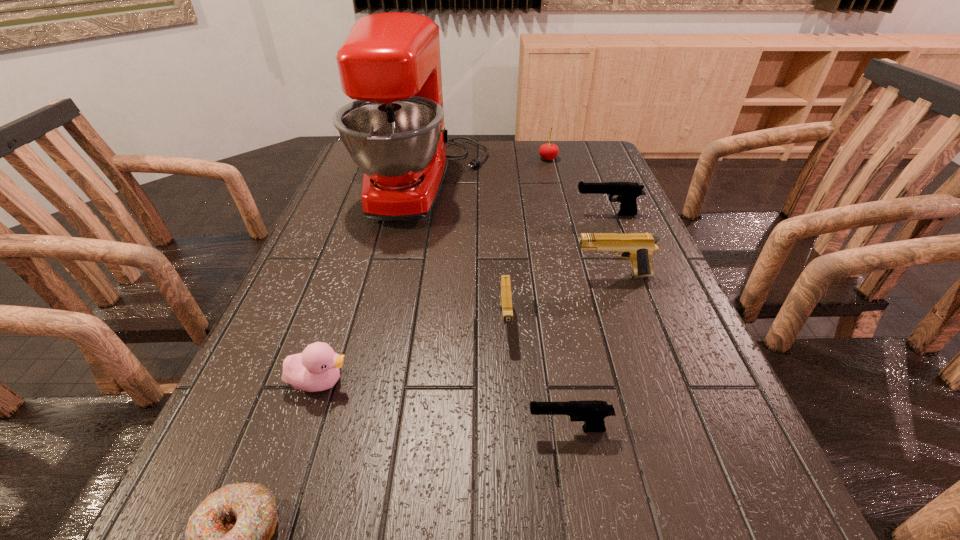
Identify the location of vacant space in between the nearer tan pistol and the red kitchen mixer. The image size is (960, 540). (466, 252).

Locate an element on the screen. This screenshot has height=540, width=960. vacant region between the nearest pistol and the fourth object from left to right is located at coordinates (537, 375).

Find the location of a particular element. This screenshot has width=960, height=540. vacant region between the right black pistol and the nearer black pistol is located at coordinates (588, 321).

Locate an element on the screen. The height and width of the screenshot is (540, 960). free space between the pink duckling and the nearer tan pistol is located at coordinates (413, 352).

Where is `blank region between the second nearest object and the kitchen mixer`? Image resolution: width=960 pixels, height=540 pixels. blank region between the second nearest object and the kitchen mixer is located at coordinates (497, 306).

The height and width of the screenshot is (540, 960). Find the location of `object that is the closest to the shortest object`. object that is the closest to the shortest object is located at coordinates (315, 369).

Identify the location of object that stands as the second closest to the shortest object. (593, 413).

Select which pistol appears as the second closest to the red cherry. Please provide its 2D coordinates. Your answer should be formatted as a tuple, i.e. [(x, y)], where the tuple contains the x and y coordinates of a point satisfying the conditions above.

[(638, 247)]

I want to click on the fourth closest pistol to the duckling, so click(x=627, y=192).

The width and height of the screenshot is (960, 540). In order to click on vacant area in the image that satisfies the following two spatial constraints: 1. at the barrel of the left tan pistol; 2. on the front-facing side of the duckling in this screenshot , I will do `click(509, 382)`.